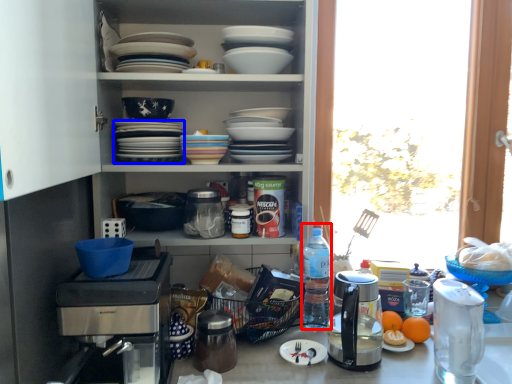
Question: Which object appears closest to the camera in this image, bottle (highlighted by a red box) or tableware (highlighted by a blue box)?

Choices:
 (A) bottle
 (B) tableware

Answer: (B)